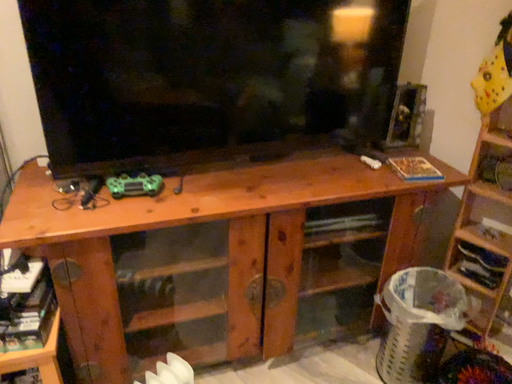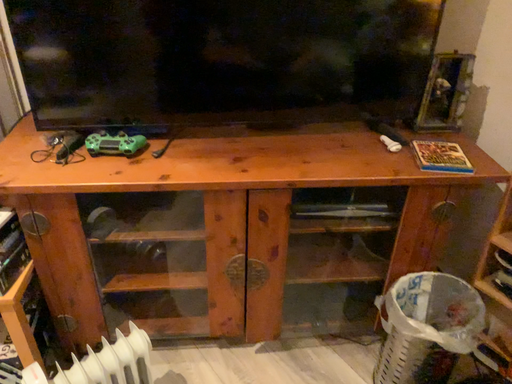
Question: Which way did the camera rotate in the video?

Choices:
 (A) rotated right
 (B) rotated left

Answer: (B)